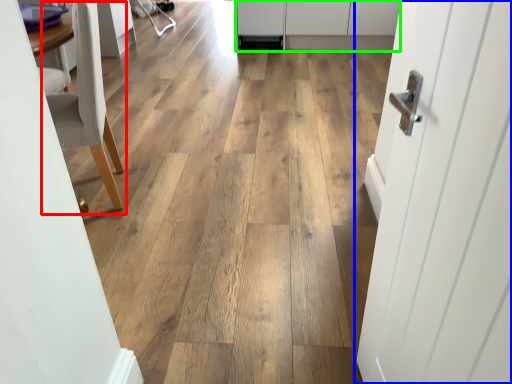
Question: Considering the real-world distances, which object is closest to chair (highlighted by a red box)? door (highlighted by a blue box) or cabinetry (highlighted by a green box).

Choices:
 (A) door
 (B) cabinetry

Answer: (A)